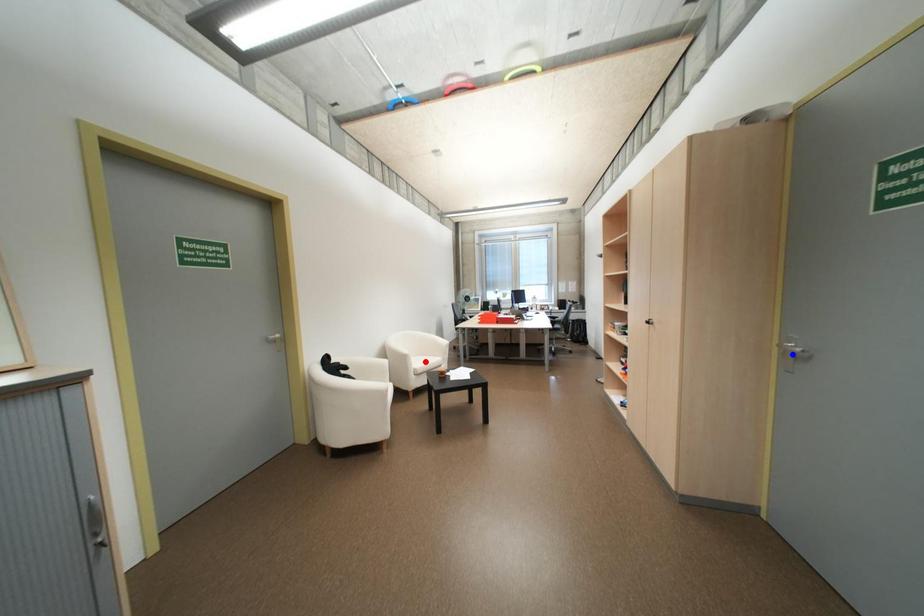
Question: Which of the two points in the image is closer to the camera?

Choices:
 (A) Blue point is closer.
 (B) Red point is closer.

Answer: (A)